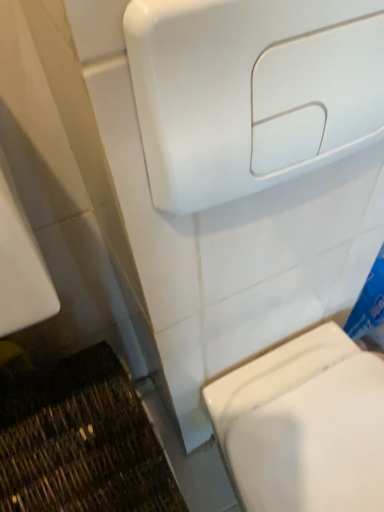
What is the approximate height of white glossy toilet at lower right?

white glossy toilet at lower right is 16.31 inches tall.

What do you see at coordinates (304, 425) in the screenshot? The height and width of the screenshot is (512, 384). I see `white glossy toilet at lower right` at bounding box center [304, 425].

The image size is (384, 512). What are the coordinates of `white glossy toilet at lower right` in the screenshot? It's located at (304, 425).

Where is `white glossy hand dryer at upper center`? The height and width of the screenshot is (512, 384). white glossy hand dryer at upper center is located at coordinates (251, 92).

This screenshot has height=512, width=384. What do you see at coordinates (251, 92) in the screenshot?
I see `white glossy hand dryer at upper center` at bounding box center [251, 92].

Where is `white glossy toilet at lower right`? The image size is (384, 512). white glossy toilet at lower right is located at coordinates (304, 425).

Visually, is white glossy toilet at lower right positioned to the left or to the right of white glossy hand dryer at upper center?

white glossy toilet at lower right is positioned on white glossy hand dryer at upper center's right side.

Considering the positions of objects white glossy toilet at lower right and white glossy hand dryer at upper center in the image provided, who is behind, white glossy toilet at lower right or white glossy hand dryer at upper center?

white glossy toilet at lower right is more distant.

Does point (325, 493) appear closer or farther from the camera than point (233, 173)?

Point (325, 493) is farther from the camera than point (233, 173).

From the image's perspective, which is below, white glossy toilet at lower right or white glossy hand dryer at upper center?

white glossy toilet at lower right, from the image's perspective.

From a real-world perspective, is white glossy toilet at lower right located higher than white glossy hand dryer at upper center?

No, from a real-world perspective, white glossy toilet at lower right is not over white glossy hand dryer at upper center

In the scene shown: Which of these two, white glossy toilet at lower right or white glossy hand dryer at upper center, is wider?

white glossy toilet at lower right.

Considering the sizes of objects white glossy toilet at lower right and white glossy hand dryer at upper center in the image provided, who is taller, white glossy toilet at lower right or white glossy hand dryer at upper center?

white glossy toilet at lower right is taller.

Can you confirm if white glossy toilet at lower right is bigger than white glossy hand dryer at upper center?

Correct, white glossy toilet at lower right is larger in size than white glossy hand dryer at upper center.

Can we say white glossy toilet at lower right lies outside white glossy hand dryer at upper center?

Yes, white glossy toilet at lower right is not within white glossy hand dryer at upper center.

Is white glossy toilet at lower right far from white glossy hand dryer at upper center?

No.

Is white glossy toilet at lower right positioned with its back to white glossy hand dryer at upper center?

No, white glossy toilet at lower right's orientation is not away from white glossy hand dryer at upper center.

At what (x,y) coordinates should I click in order to perform the action: click on hand dryer that appears on the left of white glossy toilet at lower right. Please return your answer as a coordinate pair (x, y). This screenshot has height=512, width=384. Looking at the image, I should click on click(251, 92).

Can you confirm if white glossy hand dryer at upper center is positioned to the left of white glossy toilet at lower right?

Yes, white glossy hand dryer at upper center is to the left of white glossy toilet at lower right.

Which object is more forward, white glossy hand dryer at upper center or white glossy toilet at lower right?

white glossy hand dryer at upper center is in front.

Is point (235, 182) closer to viewer compared to point (241, 428)?

That is True.

From the image's perspective, is white glossy hand dryer at upper center above or below white glossy toilet at lower right?

white glossy hand dryer at upper center is above white glossy toilet at lower right.

From a real-world perspective, is white glossy hand dryer at upper center positioned over white glossy toilet at lower right based on gravity?

Yes, from a real-world perspective, white glossy hand dryer at upper center is over white glossy toilet at lower right

From the picture: In terms of width, does white glossy hand dryer at upper center look wider or thinner when compared to white glossy toilet at lower right?

Clearly, white glossy hand dryer at upper center has less width compared to white glossy toilet at lower right.

Considering the relative sizes of white glossy hand dryer at upper center and white glossy toilet at lower right in the image provided, is white glossy hand dryer at upper center taller than white glossy toilet at lower right?

No, white glossy hand dryer at upper center is not taller than white glossy toilet at lower right.

Does white glossy hand dryer at upper center have a larger size compared to white glossy toilet at lower right?

No.

Would you say white glossy hand dryer at upper center is inside or outside white glossy toilet at lower right?

white glossy hand dryer at upper center is located beyond the bounds of white glossy toilet at lower right.

Based on the photo, is white glossy hand dryer at upper center next to white glossy toilet at lower right?

There is a gap between white glossy hand dryer at upper center and white glossy toilet at lower right.

Is white glossy hand dryer at upper center oriented away from white glossy toilet at lower right?

No, white glossy hand dryer at upper center's orientation is not away from white glossy toilet at lower right.

Identify the location of hand dryer above the white glossy toilet at lower right (from the image's perspective). (251, 92).

What are the coordinates of `toilet lying behind the white glossy hand dryer at upper center` in the screenshot? It's located at (304, 425).

The height and width of the screenshot is (512, 384). I want to click on toilet lying below the white glossy hand dryer at upper center (from the image's perspective), so pos(304,425).